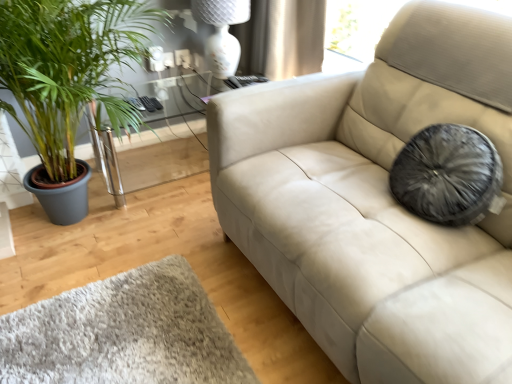
Question: From a real-world perspective, does green leafy plant at left stand above clear glass table at left?

Choices:
 (A) no
 (B) yes

Answer: (B)

Question: Is green leafy plant at left outside of clear glass table at left?

Choices:
 (A) yes
 (B) no

Answer: (A)

Question: Considering the relative sizes of green leafy plant at left and clear glass table at left in the image provided, is green leafy plant at left wider than clear glass table at left?

Choices:
 (A) yes
 (B) no

Answer: (A)

Question: From a real-world perspective, is green leafy plant at left physically below clear glass table at left?

Choices:
 (A) yes
 (B) no

Answer: (B)

Question: From the image's perspective, is green leafy plant at left on clear glass table at left?

Choices:
 (A) yes
 (B) no

Answer: (A)

Question: Is green leafy plant at left to the right of clear glass table at left from the viewer's perspective?

Choices:
 (A) yes
 (B) no

Answer: (B)

Question: From a real-world perspective, is white glossy lamp at upper center positioned over green leafy plant at left based on gravity?

Choices:
 (A) no
 (B) yes

Answer: (B)

Question: Can you confirm if white glossy lamp at upper center is positioned to the left of green leafy plant at left?

Choices:
 (A) yes
 (B) no

Answer: (B)

Question: Is the depth of white glossy lamp at upper center less than that of green leafy plant at left?

Choices:
 (A) no
 (B) yes

Answer: (A)

Question: Considering the relative sizes of white glossy lamp at upper center and green leafy plant at left in the image provided, is white glossy lamp at upper center shorter than green leafy plant at left?

Choices:
 (A) no
 (B) yes

Answer: (B)

Question: Does white glossy lamp at upper center have a larger size compared to green leafy plant at left?

Choices:
 (A) yes
 (B) no

Answer: (B)

Question: Considering the relative positions of white glossy lamp at upper center and green leafy plant at left in the image provided, is white glossy lamp at upper center behind green leafy plant at left?

Choices:
 (A) no
 (B) yes

Answer: (B)

Question: Is clear glass table at left to the left of green leafy plant at left from the viewer's perspective?

Choices:
 (A) yes
 (B) no

Answer: (B)